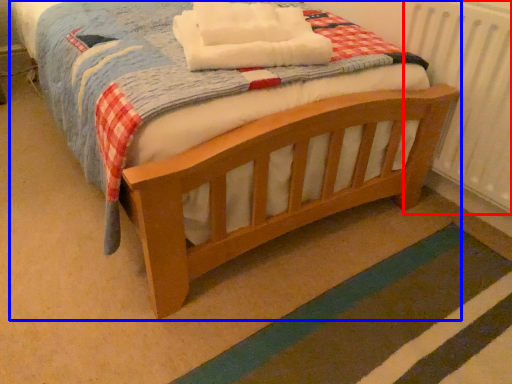
Question: Which object is further to the camera taking this photo, radiator (highlighted by a red box) or bed (highlighted by a blue box)?

Choices:
 (A) radiator
 (B) bed

Answer: (A)